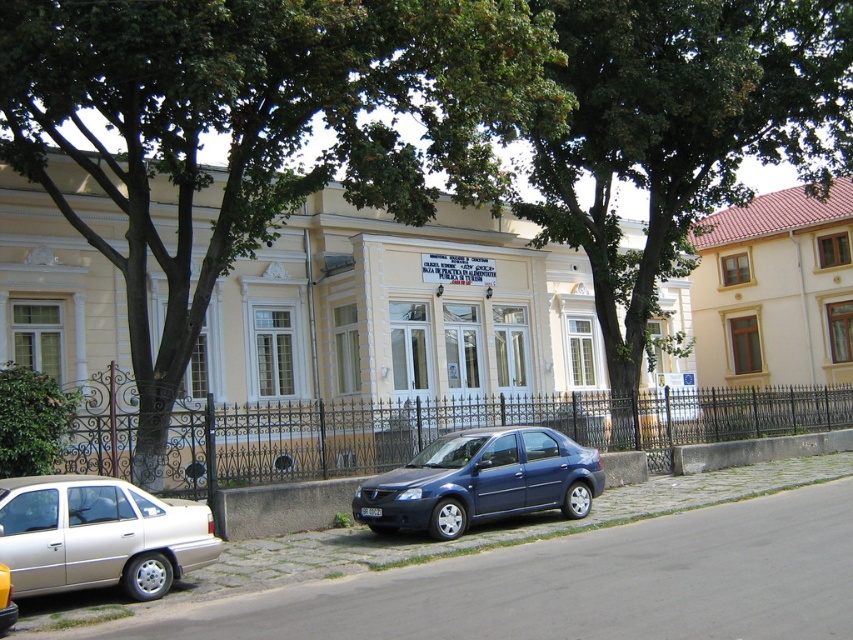
Can you confirm if green leafy tree at upper center is thinner than gray concrete curb at lower center?

No, green leafy tree at upper center is not thinner than gray concrete curb at lower center.

Is point (495, 19) less distant than point (671, 605)?

That is False.

Find the location of a particular element. The image size is (853, 640). green leafy tree at upper center is located at coordinates (260, 128).

Between metallic silver sedan at lower left and satin blue sedan at center, which one is positioned higher?

satin blue sedan at center is above.

Between metallic silver sedan at lower left and satin blue sedan at center, which one is positioned lower?

metallic silver sedan at lower left

This screenshot has width=853, height=640. I want to click on metallic silver sedan at lower left, so click(x=97, y=536).

Image resolution: width=853 pixels, height=640 pixels. I want to click on metallic silver sedan at lower left, so click(x=97, y=536).

Does point (531, 602) come in front of point (543, 477)?

Yes, it is.

Does point (651, 564) come in front of point (416, 481)?

Yes, it is in front of point (416, 481).

I want to click on gray concrete curb at lower center, so click(550, 572).